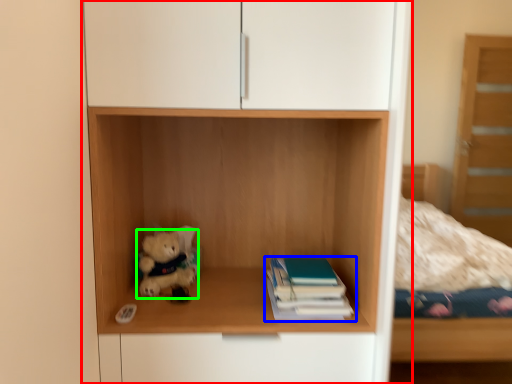
Question: Considering the real-world distances, which object is farthest from cupboard (highlighted by a red box)? book (highlighted by a blue box) or teddy bear (highlighted by a green box)?

Choices:
 (A) book
 (B) teddy bear

Answer: (B)